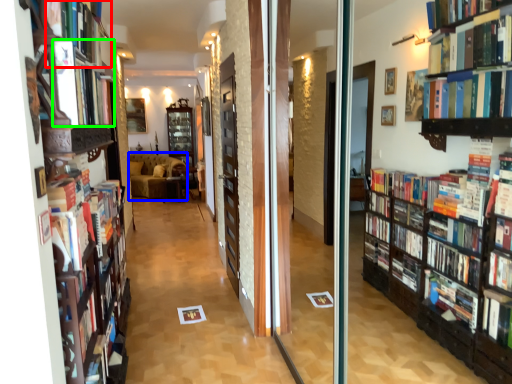
Question: Based on their relative distances, which object is nearer to book (highlighted by a red box)? Choose from furniture (highlighted by a blue box) and book (highlighted by a green box).

Choices:
 (A) furniture
 (B) book

Answer: (B)